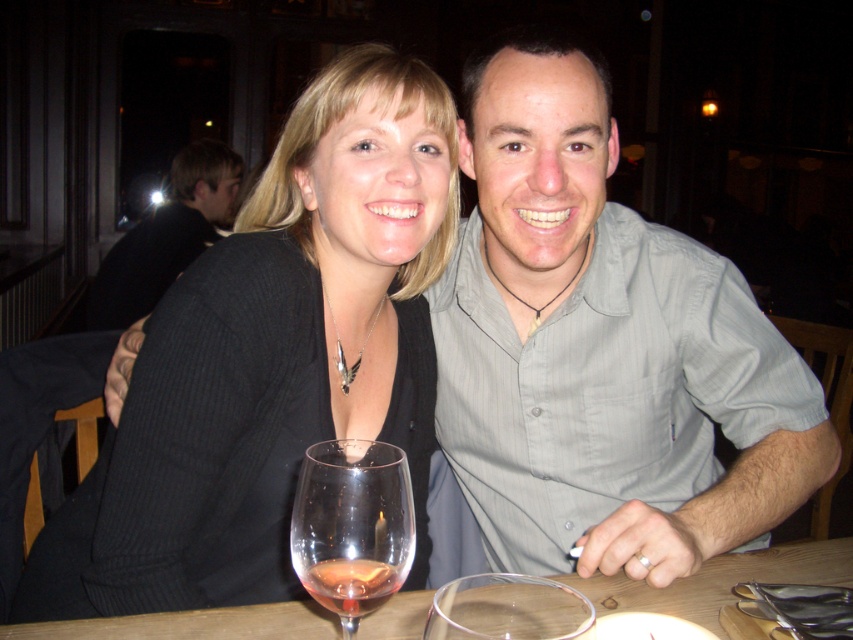
You are a waiter in a restaurant. You need to serve a customer who is seated near the clear glass wine glass at center and the dark gray shirt at upper left. Which object is closer to the customer?

The clear glass wine glass at center is closer to the customer because it is positioned at the center of the table, while the dark gray shirt at upper left is located further away at the upper left position.

You are taking a photo of the scene and want to focus on both point (45, 561) and point (793, 545). Which point should you focus on first to ensure both are in focus?

You should focus on point (45, 561) first because it is closer to the camera than point (793, 545). By focusing on the closer point, the depth of field may also keep the farther point in focus.